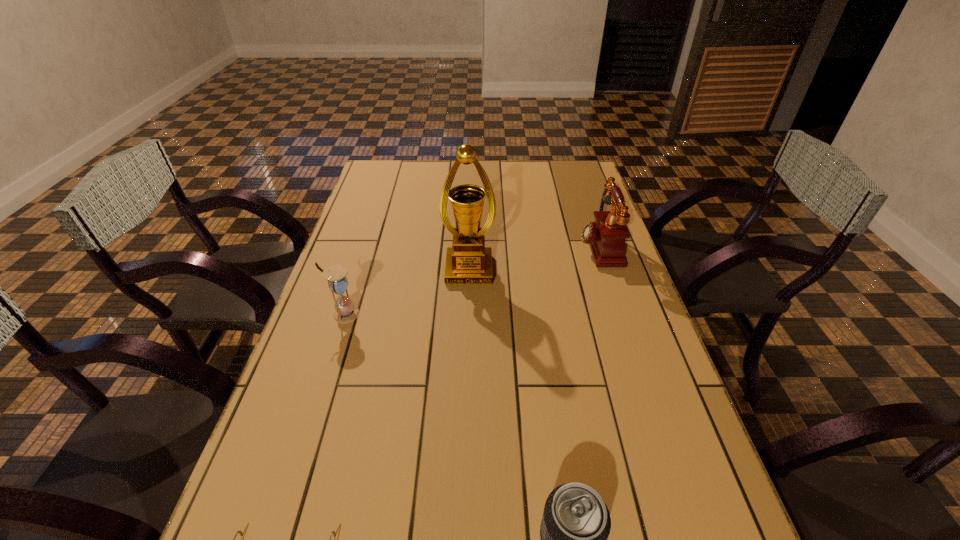
The height and width of the screenshot is (540, 960). Identify the location of object that is the nearest to the spectacles. (576, 523).

Where is `the second closest object to the hourglass`? the second closest object to the hourglass is located at coordinates (240, 532).